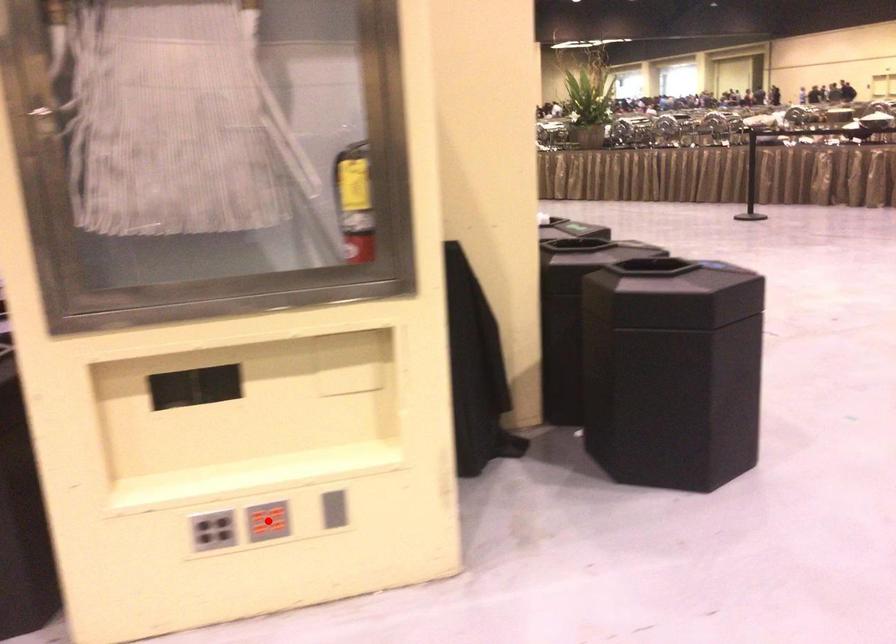
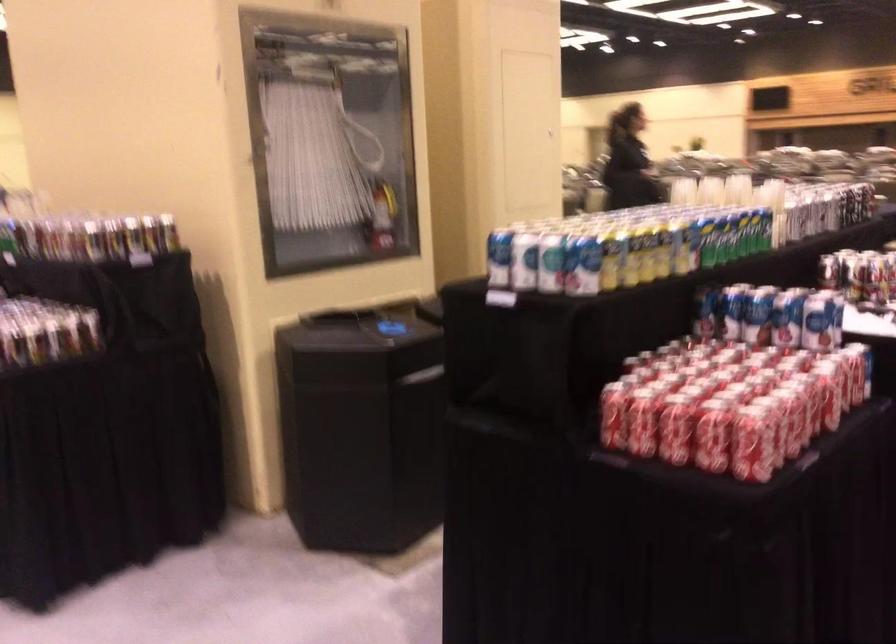
Question: I am providing you with two images of the same scene from different viewpoints. A red point is marked on the first image. Can you still see the location of the red point in image 2?

Choices:
 (A) Yes
 (B) No

Answer: (B)